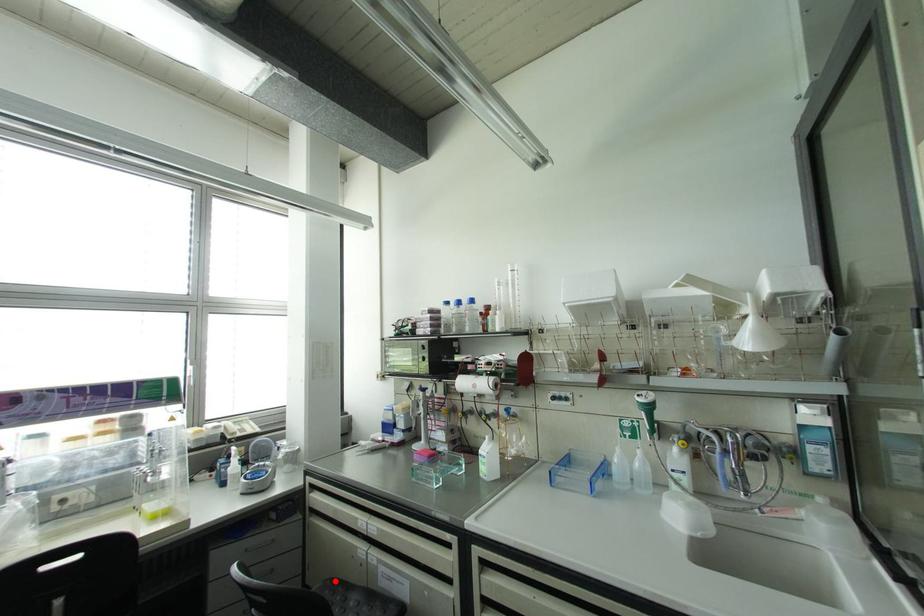
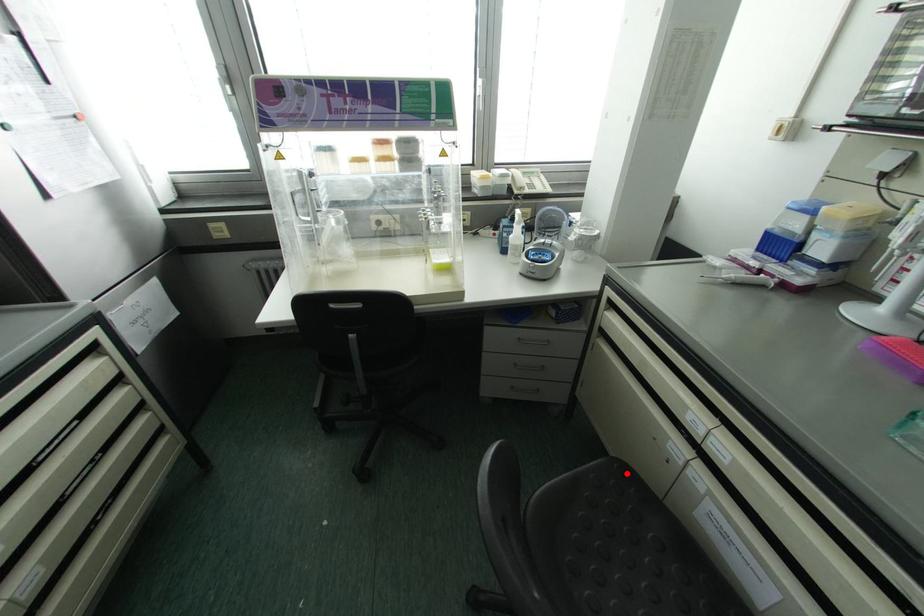
I am providing you with two images of the same scene from different viewpoints. A red point is marked on the first image and another point is marked on the second image. Do the highlighted points in image1 and image2 indicate the same real-world spot?

Yes